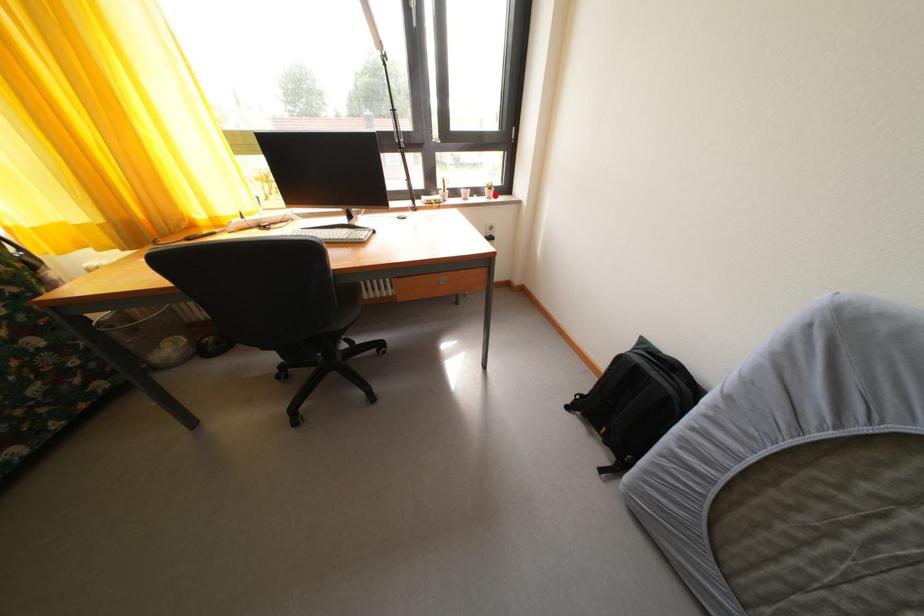
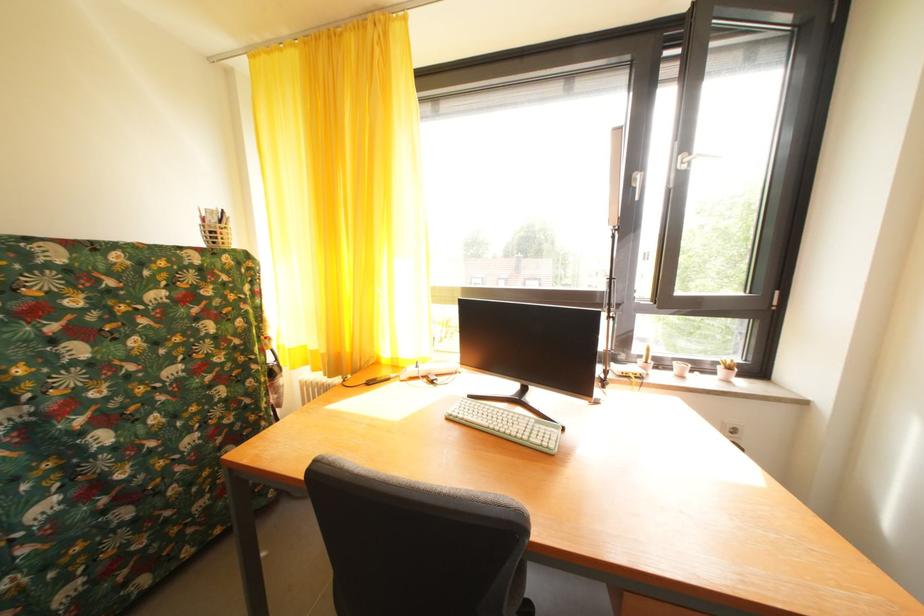
Where in the second image is the point corresponding to the highlighted location from the first image?

(728, 374)